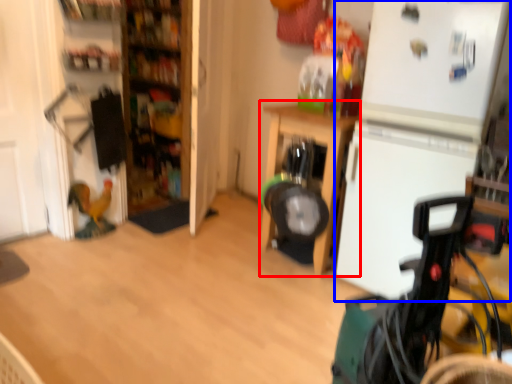
Question: Among these objects, which one is farthest to the camera, furniture (highlighted by a red box) or fridge (highlighted by a blue box)?

Choices:
 (A) furniture
 (B) fridge

Answer: (A)